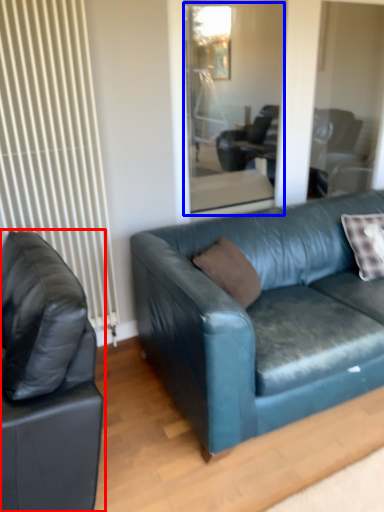
Question: Which point is further to the camera, studio couch (highlighted by a red box) or glass door (highlighted by a blue box)?

Choices:
 (A) studio couch
 (B) glass door

Answer: (B)